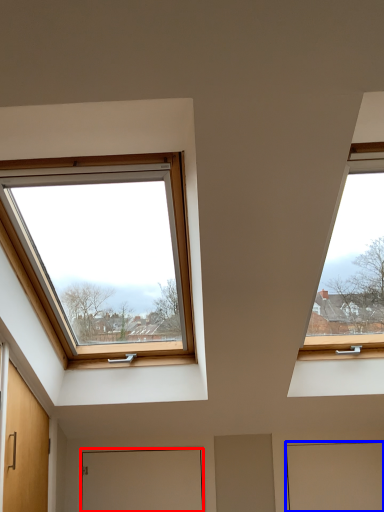
Question: Among these objects, which one is farthest to the camera, door (highlighted by a red box) or door (highlighted by a blue box)?

Choices:
 (A) door
 (B) door

Answer: (A)